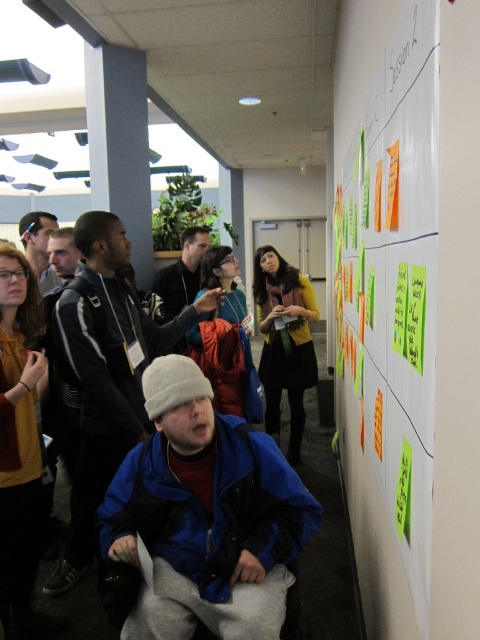
You are standing in the room and want to reach the point marked at coordinates (166, 300). If you can move forward 12 feet, will you be able to reach that point?

The point at coordinates (166, 300) is 12.16 feet away from you. Since you can move forward 12 feet, you will not quite reach it as you need an extra 0.16 feet.